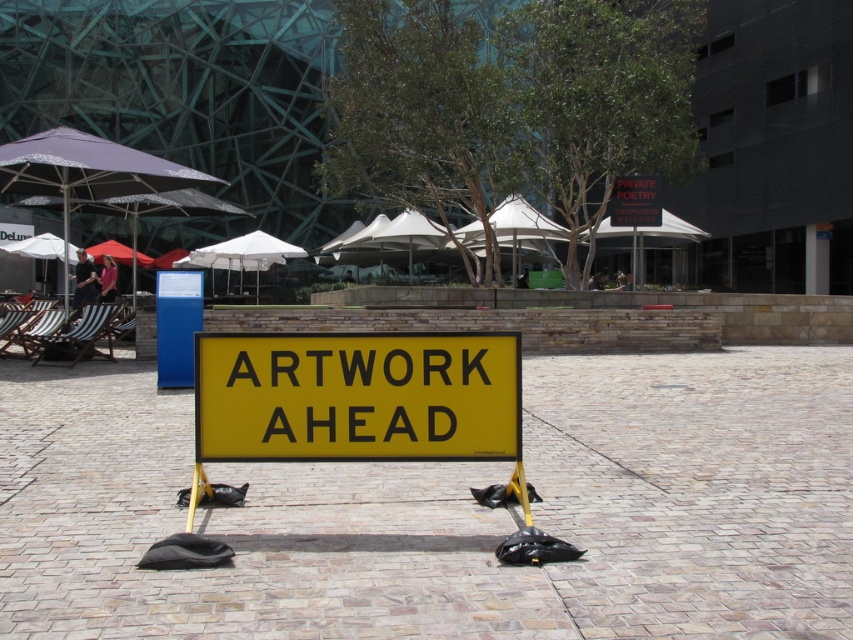
In the scene shown: Which of these two, yellow/yellowish metal sign at center or purple fabric umbrella at upper left, stands shorter?

yellow/yellowish metal sign at center is shorter.

Does yellow/yellowish metal sign at center have a greater height compared to purple fabric umbrella at upper left?

Incorrect, yellow/yellowish metal sign at center's height is not larger of purple fabric umbrella at upper left's.

Where is `yellow/yellowish metal sign at center`? The width and height of the screenshot is (853, 640). yellow/yellowish metal sign at center is located at coordinates (357, 396).

Find the location of a particular element. yellow/yellowish metal sign at center is located at coordinates point(357,396).

Does point (209, 385) lie in front of point (643, 195)?

Yes, point (209, 385) is in front of point (643, 195).

Does yellow/yellowish metal sign at center have a smaller size compared to black plastic sign at center?

Correct, yellow/yellowish metal sign at center occupies less space than black plastic sign at center.

Is point (482, 442) in front of point (656, 205)?

Yes.

At what (x,y) coordinates should I click in order to perform the action: click on yellow/yellowish metal sign at center. Please return your answer as a coordinate pair (x, y). Image resolution: width=853 pixels, height=640 pixels. Looking at the image, I should click on (357, 396).

Which is above, purple fabric umbrella at upper left or black plastic sign at center?

Positioned higher is purple fabric umbrella at upper left.

Looking at this image, is purple fabric umbrella at upper left positioned before black plastic sign at center?

Yes.

Describe the element at coordinates (86, 172) in the screenshot. I see `purple fabric umbrella at upper left` at that location.

The width and height of the screenshot is (853, 640). In order to click on purple fabric umbrella at upper left in this screenshot , I will do `click(86, 172)`.